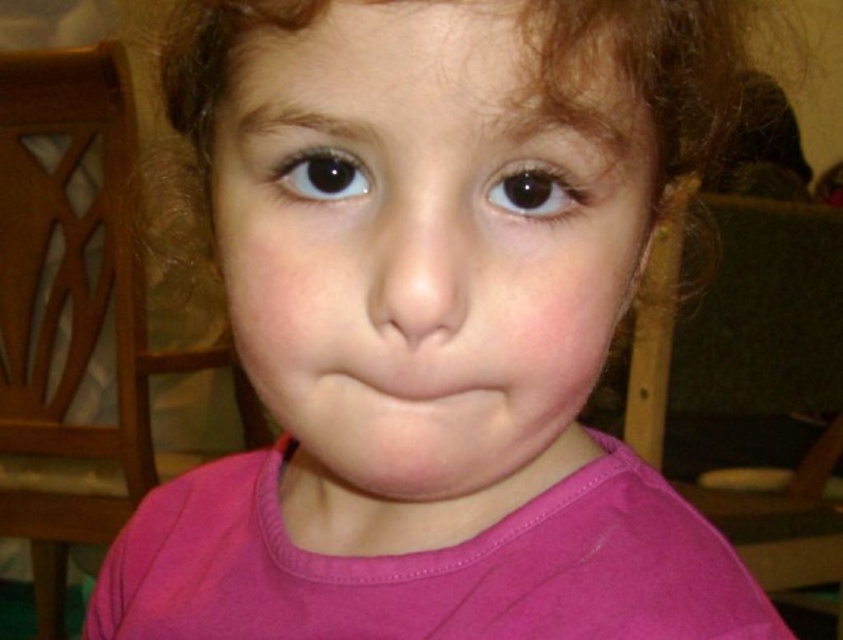
Is smooth skin face at center below brown shiny eye at center?

Yes, smooth skin face at center is below brown shiny eye at center.

Is smooth skin face at center taller than brown shiny eye at center?

Yes, smooth skin face at center is taller than brown shiny eye at center.

Is point (481, 145) behind point (576, 188)?

No, (481, 145) is in front of (576, 188).

This screenshot has width=843, height=640. I want to click on smooth skin face at center, so tap(419, 253).

Can you confirm if brown shiny eye at center is taller than black glossy eye at upper left?

Yes, brown shiny eye at center is taller than black glossy eye at upper left.

Is point (535, 164) closer to camera compared to point (305, 189)?

Yes, it is.

The width and height of the screenshot is (843, 640). I want to click on brown shiny eye at center, so click(x=534, y=189).

Who is lower down, smooth skin face at center or black glossy eye at upper left?

→ smooth skin face at center is below.

Between smooth skin face at center and black glossy eye at upper left, which one has more height?

smooth skin face at center is taller.

Locate an element on the screen. This screenshot has width=843, height=640. smooth skin face at center is located at coordinates (419, 253).

The width and height of the screenshot is (843, 640). What are the coordinates of `smooth skin face at center` in the screenshot? It's located at (419, 253).